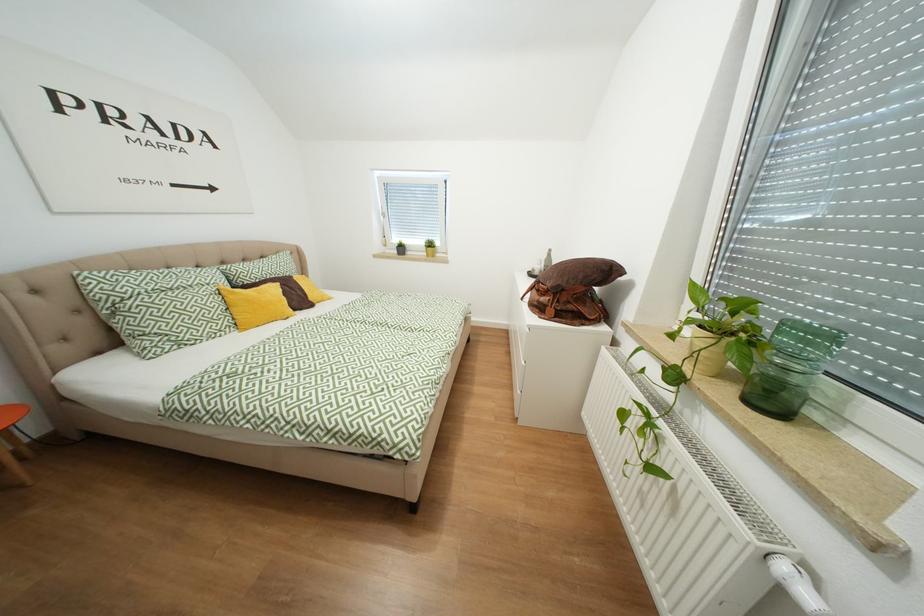
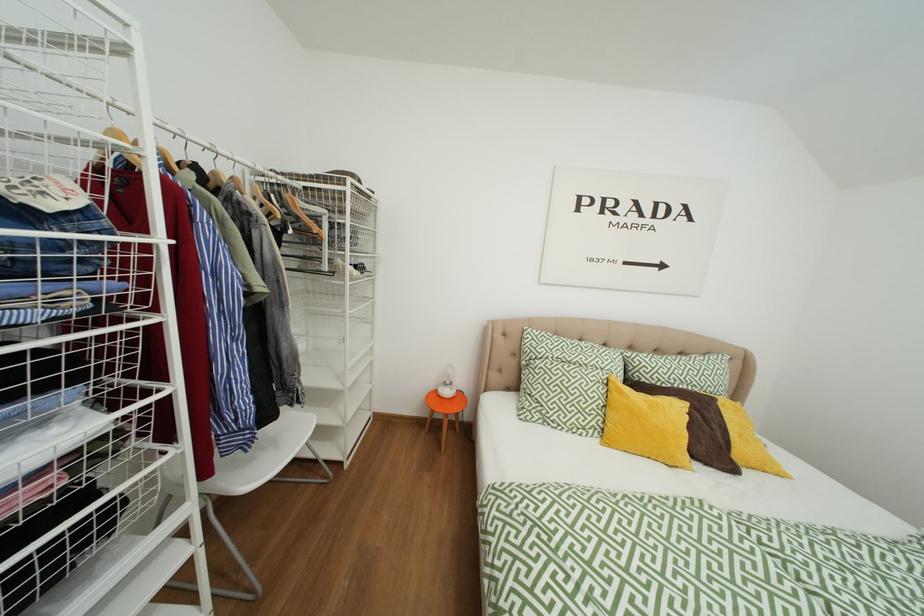
Question: The camera is either moving clockwise (left) or counter-clockwise (right) around the object. The first image is from the beginning of the video and the second image is from the end. Is the camera moving left or right when shooting the video?

Choices:
 (A) Left
 (B) Right

Answer: (B)